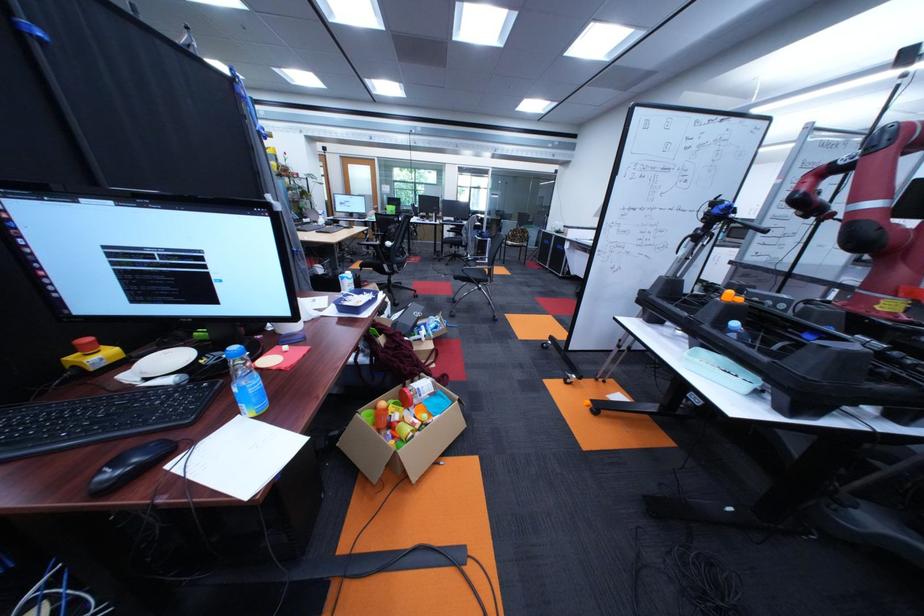
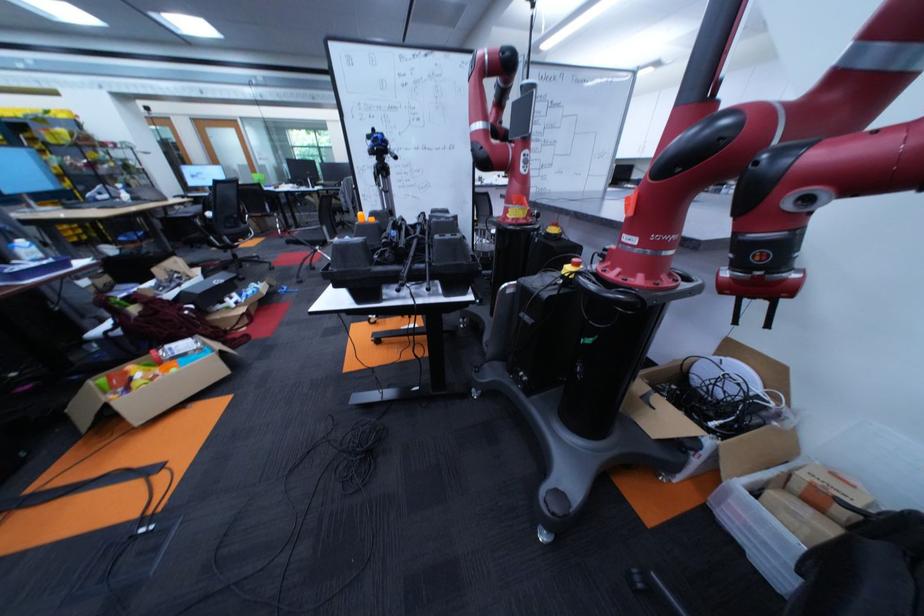
Locate, in the second image, the point that corresponds to [438,387] in the first image.

(198, 345)